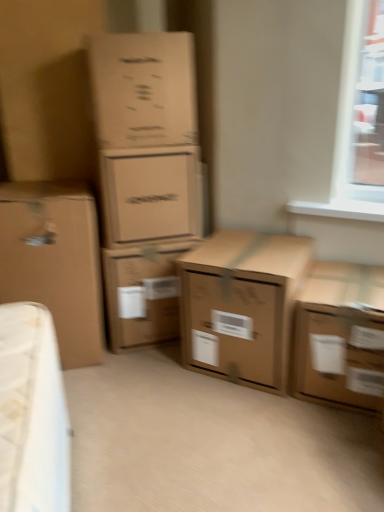
Question: Would you consider matte cardboard box at center, marked as the 3th box in a left-to-right arrangement, to be distant from brown cardboard box at upper left, marked as the 5th box in a right-to-left arrangement?

Choices:
 (A) yes
 (B) no

Answer: (B)

Question: Can you confirm if matte cardboard box at center, marked as the 3th box in a left-to-right arrangement, is wider than brown cardboard box at upper left, the second box viewed from the left?

Choices:
 (A) yes
 (B) no

Answer: (B)

Question: Can you confirm if matte cardboard box at center, marked as the 3th box in a left-to-right arrangement, is thinner than brown cardboard box at upper left, marked as the 5th box in a right-to-left arrangement?

Choices:
 (A) yes
 (B) no

Answer: (A)

Question: Considering the relative positions of matte cardboard box at center, the fourth box when ordered from right to left, and brown cardboard box at upper left, the second box viewed from the left, in the image provided, is matte cardboard box at center, the fourth box when ordered from right to left, to the left of brown cardboard box at upper left, the second box viewed from the left, from the viewer's perspective?

Choices:
 (A) no
 (B) yes

Answer: (A)

Question: Considering the relative sizes of matte cardboard box at center, the fourth box when ordered from right to left, and brown cardboard box at upper left, marked as the 5th box in a right-to-left arrangement, in the image provided, is matte cardboard box at center, the fourth box when ordered from right to left, smaller than brown cardboard box at upper left, marked as the 5th box in a right-to-left arrangement,?

Choices:
 (A) yes
 (B) no

Answer: (A)

Question: Considering the relative positions of matte cardboard box at center, marked as the 3th box in a left-to-right arrangement, and brown cardboard box at upper left, marked as the 5th box in a right-to-left arrangement, in the image provided, is matte cardboard box at center, marked as the 3th box in a left-to-right arrangement, to the right of brown cardboard box at upper left, marked as the 5th box in a right-to-left arrangement, from the viewer's perspective?

Choices:
 (A) no
 (B) yes

Answer: (B)

Question: Does brown cardboard box at upper left, the second box viewed from the left, have a greater height compared to brown cardboard box at center, the fifth box in the left-to-right sequence?

Choices:
 (A) yes
 (B) no

Answer: (B)

Question: Is brown cardboard box at upper left, marked as the 5th box in a right-to-left arrangement, shorter than brown cardboard box at center, the fifth box in the left-to-right sequence?

Choices:
 (A) no
 (B) yes

Answer: (B)

Question: Could you tell me if brown cardboard box at upper left, marked as the 5th box in a right-to-left arrangement, is turned towards brown cardboard box at center, the fifth box in the left-to-right sequence?

Choices:
 (A) yes
 (B) no

Answer: (B)

Question: Is brown cardboard box at upper left, the second box viewed from the left, further to the viewer compared to brown cardboard box at center, positioned as the 2th box in right-to-left order?

Choices:
 (A) no
 (B) yes

Answer: (B)

Question: Is brown cardboard box at upper left, marked as the 5th box in a right-to-left arrangement, in front of brown cardboard box at center, the fifth box in the left-to-right sequence?

Choices:
 (A) no
 (B) yes

Answer: (A)

Question: From the image's perspective, is brown cardboard box at upper left, the second box viewed from the left, over brown cardboard box at center, the fifth box in the left-to-right sequence?

Choices:
 (A) no
 (B) yes

Answer: (B)

Question: Can you confirm if brown cardboard box at lower right, the 1th box positioned from the right, is shorter than brown cardboard box at center, the third box positioned from the right?

Choices:
 (A) yes
 (B) no

Answer: (A)